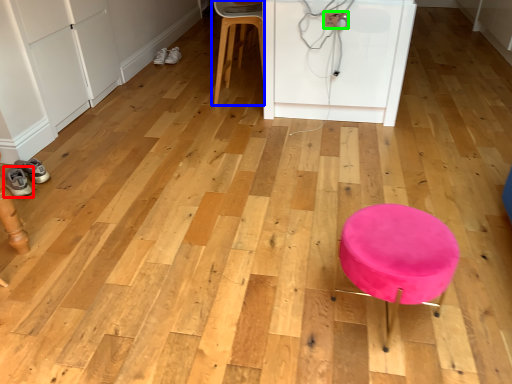
Question: Which object is the closest to the footwear (highlighted by a red box)? Choose among these: chair (highlighted by a blue box) or electric outlet (highlighted by a green box).

Choices:
 (A) chair
 (B) electric outlet

Answer: (A)